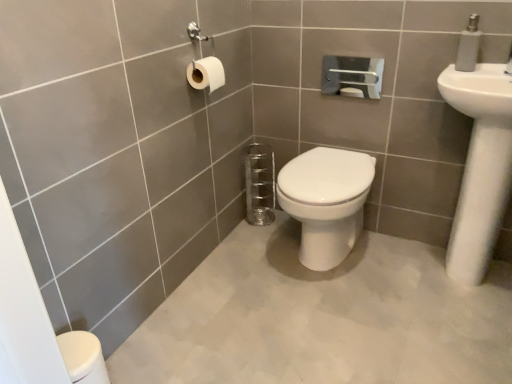
At what (x,y) coordinates should I click in order to perform the action: click on free space to the right of white glossy toilet at center. Please return your answer as a coordinate pair (x, y). Looking at the image, I should click on pyautogui.click(x=397, y=259).